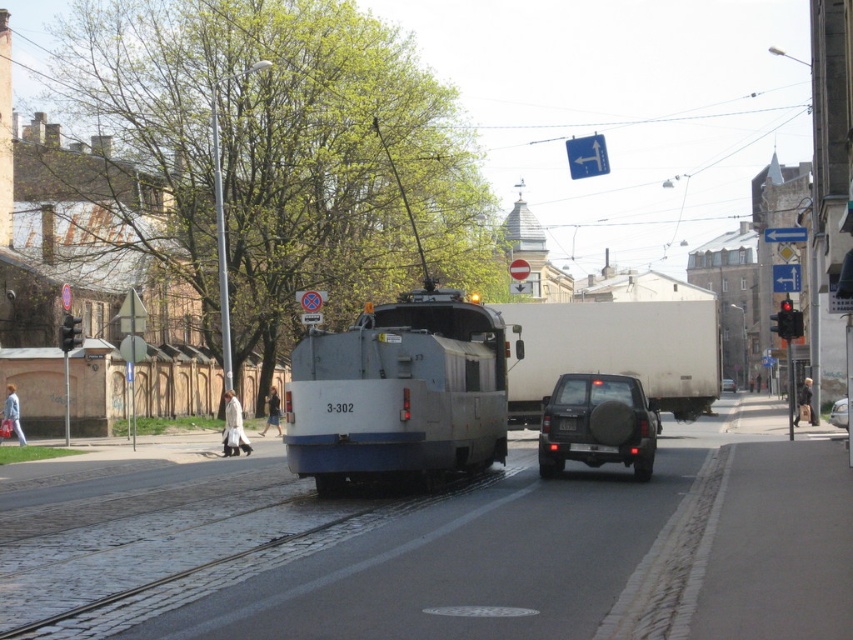
You are a pedestrian standing at the crosswalk ahead of the tram. You need to cross the street but must avoid the parked vehicles. Which vehicle should you walk around first, the white matte truck at center or the dark gray matte suv at center?

You should walk around the white matte truck at center first because it is closer to you than the dark gray matte suv at center, which is further away.